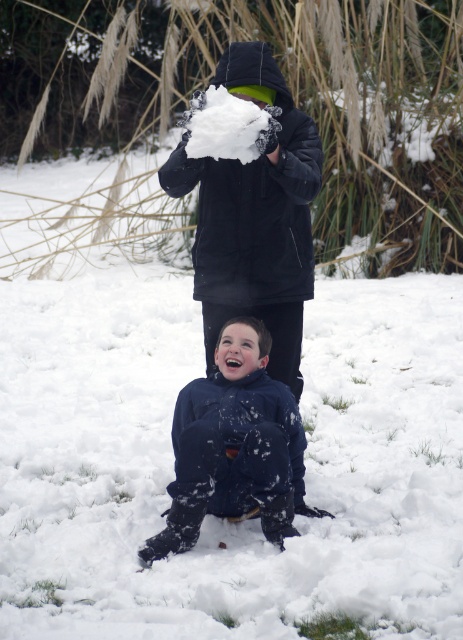
Question: Which point appears farthest from the camera in this image?

Choices:
 (A) (236, 444)
 (B) (217, 312)

Answer: (B)

Question: Can you confirm if matte black jacket at upper center is smaller than dark blue snowsuit at center?

Choices:
 (A) no
 (B) yes

Answer: (A)

Question: Is matte black jacket at upper center to the right of dark blue snowsuit at center from the viewer's perspective?

Choices:
 (A) no
 (B) yes

Answer: (B)

Question: Does matte black jacket at upper center appear on the right side of dark blue snowsuit at center?

Choices:
 (A) yes
 (B) no

Answer: (A)

Question: Which point is closer to the camera taking this photo?

Choices:
 (A) (219, 250)
 (B) (204, 406)

Answer: (B)